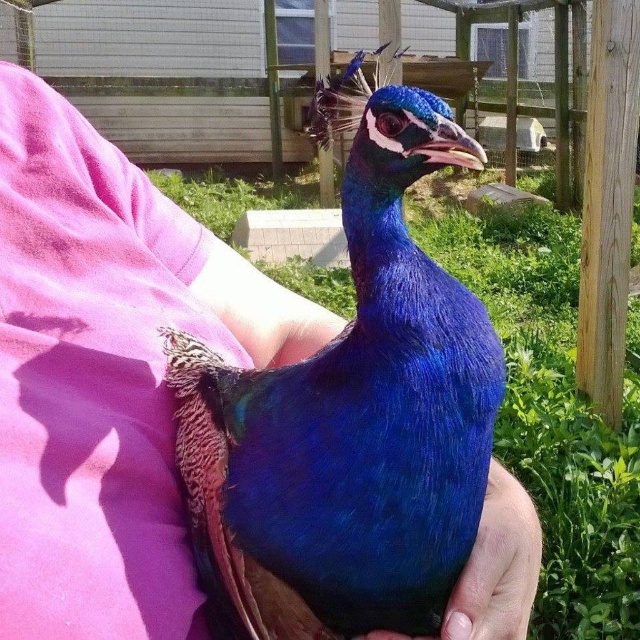
You are a photographer trying to capture the peacock in the image. You need to ensure the shiny blue peacock at center is visible without being obscured by the satin blue feather at center. Is this possible based on their positions?

The shiny blue peacock at center is positioned over the satin blue feather at center, so part of the peacock may block the feather in the photo. Adjust your angle to ensure both are visible.

Based on the photo, you are a photographer aiming to capture a closeup shot of the shiny blue peacock at center and the satin blue feather at center. Your camera has a depth of field that can focus on objects within a 3.5 inch range. Will both subjects be in focus?

The distance between the shiny blue peacock at center and the satin blue feather at center is 3.85 inches, which exceeds the camera depth of field range of 3.5 inches. Thus, both subjects cannot be in focus simultaneously.